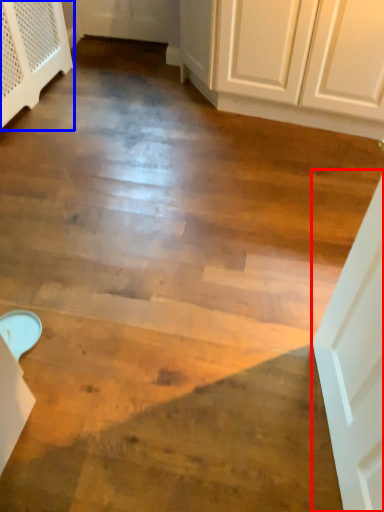
Question: Among these objects, which one is farthest to the camera, door (highlighted by a red box) or dresser (highlighted by a blue box)?

Choices:
 (A) door
 (B) dresser

Answer: (B)